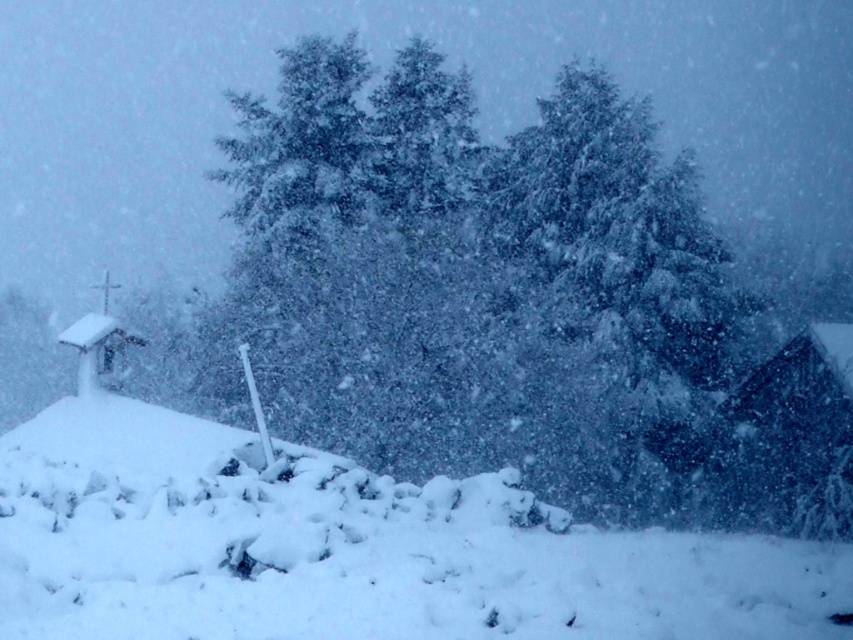
Which is more to the left, white fluffy snow at lower center or wooden cabin at right?

Positioned to the left is white fluffy snow at lower center.

Can you confirm if white fluffy snow at lower center is positioned above wooden cabin at right?

Indeed, white fluffy snow at lower center is positioned over wooden cabin at right.

I want to click on white fluffy snow at lower center, so click(x=350, y=548).